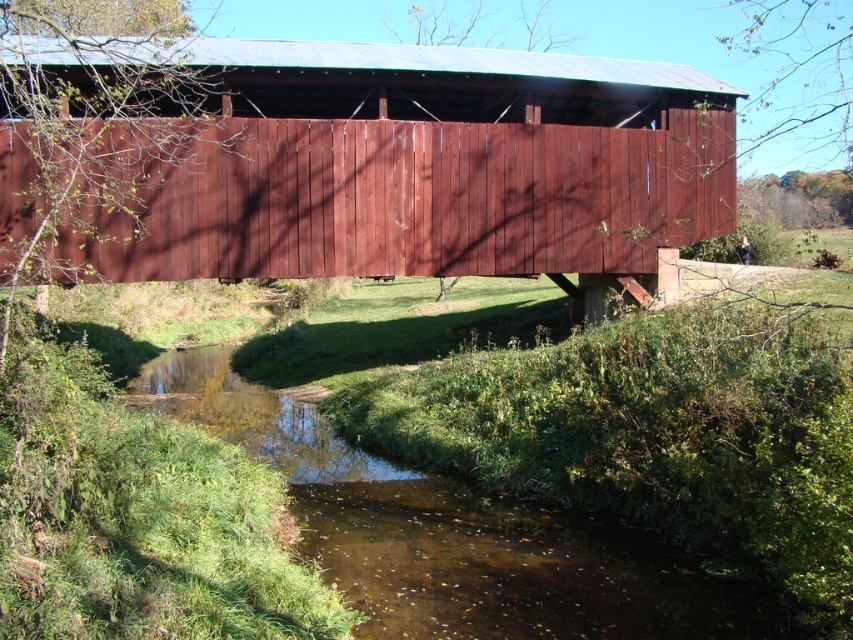
You are a hiker who wants to cross the stream safely. You see the smooth wood bridge at center and the clear water at center. Which path should you choose to avoid getting your feet wet?

You should choose the smooth wood bridge at center to avoid getting your feet wet because it is above the clear water at center, providing a dry crossing.

You are a hiker carrying a 2 meter long wooden plank. You need to cross the stream using the bridge. Can you safely carry the plank horizontally across the smooth wood bridge at center without it touching the clear water at center?

The smooth wood bridge at center might be wider than clear water at center, so there is a possibility that the bridge is wide enough to allow the 2 meter plank to be carried horizontally without touching the water. However, since the exact width difference is uncertain, it is recommended to check the bridge width before attempting.

You are standing on the rustic wooden covered bridge and want to take a photo of both the point at coordinates (447, 90) and the point at (434, 492). Which point should you focus on first to ensure both are in the frame?

You should focus on the point at coordinates (447, 90) first because it is closer to you than the point at (434, 492), ensuring both points are within the camera frame.